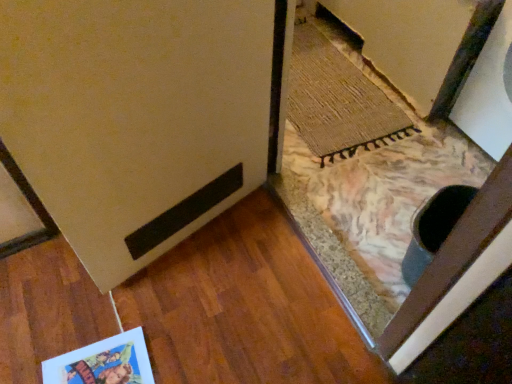
Question: Considering the relative sizes of rug at lower right and matte beige door at lower left in the image provided, is rug at lower right thinner than matte beige door at lower left?

Choices:
 (A) no
 (B) yes

Answer: (A)

Question: Is rug at lower right to the left of matte beige door at lower left from the viewer's perspective?

Choices:
 (A) yes
 (B) no

Answer: (B)

Question: From the image's perspective, is rug at lower right below matte beige door at lower left?

Choices:
 (A) yes
 (B) no

Answer: (B)

Question: From a real-world perspective, is rug at lower right beneath matte beige door at lower left?

Choices:
 (A) no
 (B) yes

Answer: (B)

Question: Can you confirm if rug at lower right is positioned to the right of matte beige door at lower left?

Choices:
 (A) yes
 (B) no

Answer: (A)

Question: Is matte beige door at lower left at the back of rug at lower right?

Choices:
 (A) no
 (B) yes

Answer: (A)

Question: Is the position of matte cardboard postcard at lower left more distant than that of rug at lower right?

Choices:
 (A) yes
 (B) no

Answer: (B)

Question: Can you confirm if matte cardboard postcard at lower left is bigger than rug at lower right?

Choices:
 (A) no
 (B) yes

Answer: (A)

Question: Is matte cardboard postcard at lower left taller than rug at lower right?

Choices:
 (A) no
 (B) yes

Answer: (B)

Question: Is matte cardboard postcard at lower left closer to the viewer compared to rug at lower right?

Choices:
 (A) no
 (B) yes

Answer: (B)

Question: Is matte cardboard postcard at lower left looking in the opposite direction of rug at lower right?

Choices:
 (A) no
 (B) yes

Answer: (A)

Question: Is matte cardboard postcard at lower left thinner than rug at lower right?

Choices:
 (A) no
 (B) yes

Answer: (B)

Question: From a real-world perspective, is matte cardboard postcard at lower left physically below matte beige door at lower left?

Choices:
 (A) yes
 (B) no

Answer: (A)